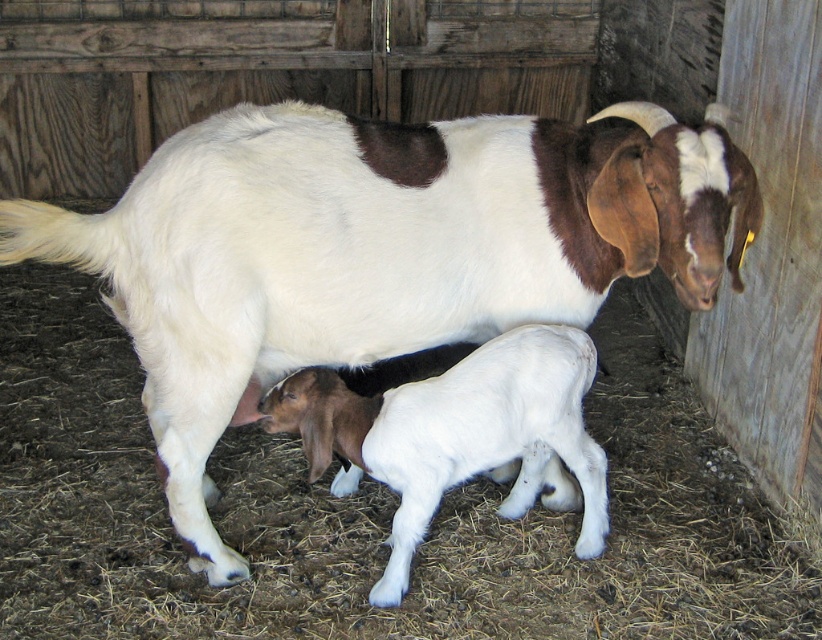
Who is more forward, [470,285] or [529,454]?

Point [470,285]

Does white soft fur goat at center appear on the left side of white woolen lamb at center?

Indeed, white soft fur goat at center is positioned on the left side of white woolen lamb at center.

Is point (130, 316) positioned in front of point (432, 484)?

Yes, it is in front of point (432, 484).

At what (x,y) coordinates should I click in order to perform the action: click on white soft fur goat at center. Please return your answer as a coordinate pair (x, y). This screenshot has height=640, width=822. Looking at the image, I should click on (377, 250).